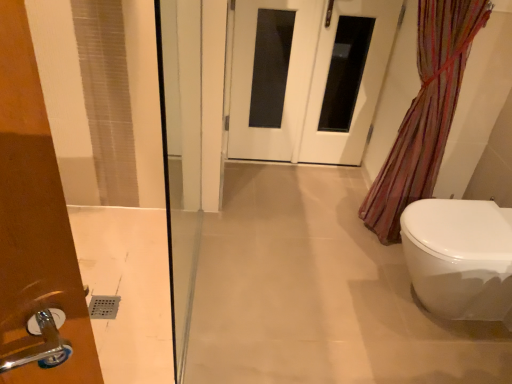
What are the coordinates of `vacant space in front of white glossy toilet at lower right` in the screenshot? It's located at (448, 359).